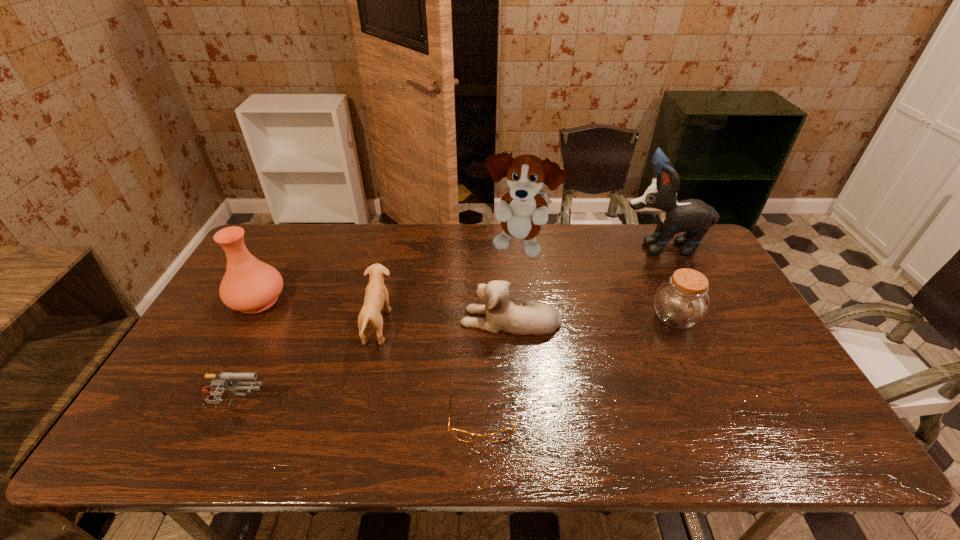
The height and width of the screenshot is (540, 960). Identify the location of the rightmost puppy. (694, 217).

Find the location of a particular element. The image size is (960, 540). the sixth shortest object is located at coordinates (249, 285).

Find the location of a particular element. The image size is (960, 540). jar is located at coordinates (681, 302).

Find the location of a particular element. the sixth object from right to left is located at coordinates (376, 295).

Find the location of a particular element. The width and height of the screenshot is (960, 540). gun is located at coordinates (210, 396).

What are the coordinates of `spectacles` in the screenshot? It's located at (461, 435).

Find the location of `free space located 0.220m on the front-facing side of the rightmost puppy`. free space located 0.220m on the front-facing side of the rightmost puppy is located at coordinates (554, 246).

Locate an element on the screen. vacant space located 0.120m on the front-facing side of the rightmost puppy is located at coordinates (583, 246).

Identify the location of free location located on the front-facing side of the rightmost puppy. (515, 246).

Where is `free region located on the right of the vase`? free region located on the right of the vase is located at coordinates click(x=395, y=300).